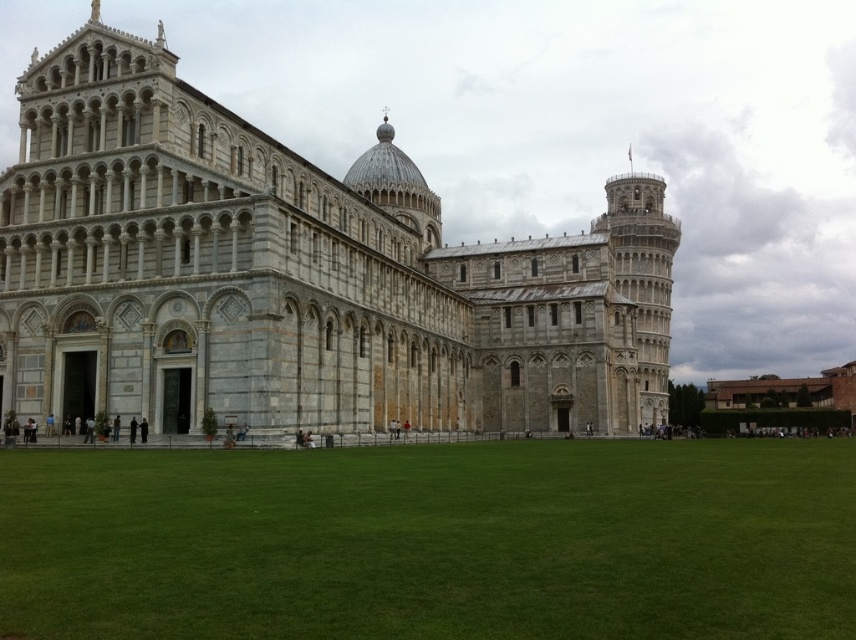
Between gray stone cathedral at center and green grass at center, which one is positioned higher?

gray stone cathedral at center is above.

Which of these two, gray stone cathedral at center or green grass at center, stands shorter?

With less height is green grass at center.

Is point (199, 152) behind point (461, 577)?

Yes, point (199, 152) is behind point (461, 577).

Where is `gray stone cathedral at center`? Image resolution: width=856 pixels, height=640 pixels. gray stone cathedral at center is located at coordinates (296, 275).